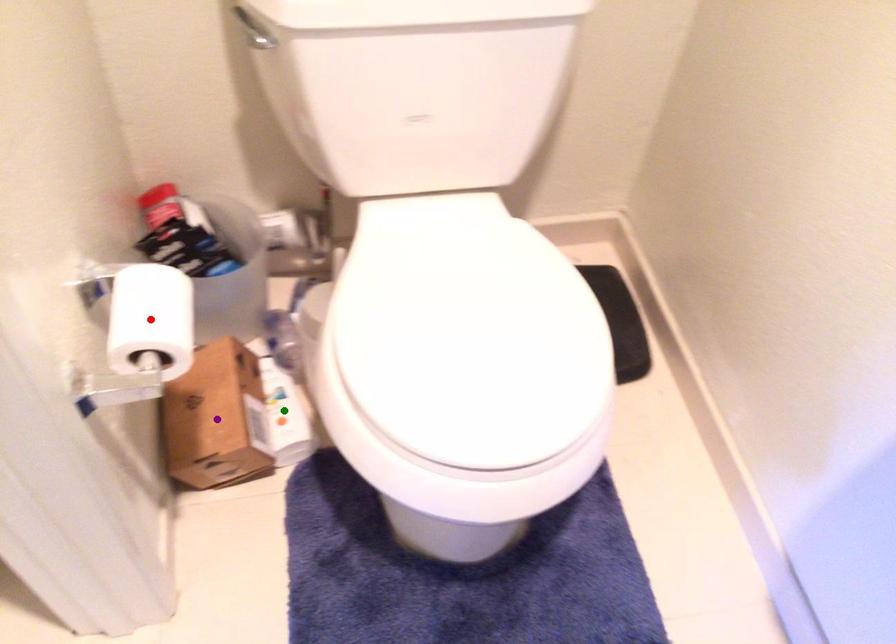
Order these from nearest to farthest:
1. red point
2. green point
3. purple point

1. green point
2. purple point
3. red point